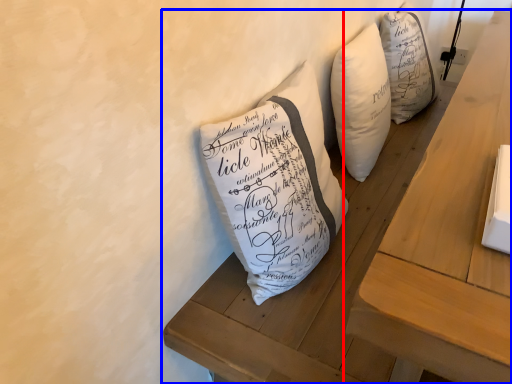
Question: Which object is further to the camera taking this photo, table (highlighted by a red box) or furniture (highlighted by a blue box)?

Choices:
 (A) table
 (B) furniture

Answer: (B)